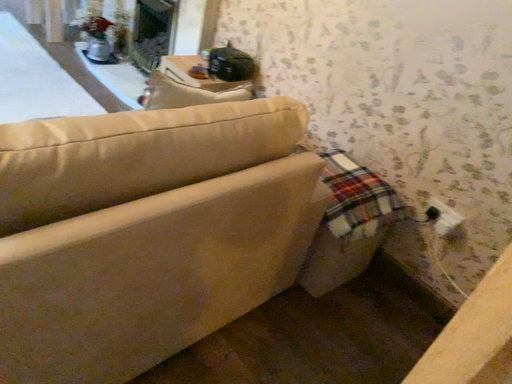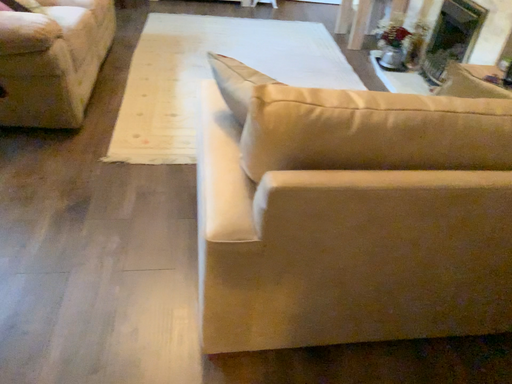
Question: How did the camera likely rotate when shooting the video?

Choices:
 (A) rotated right
 (B) rotated left

Answer: (B)